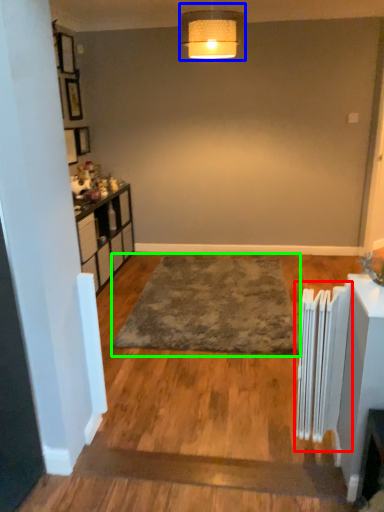
Question: Estimate the real-world distances between objects in this image. Which object is closer to radiator (highlighted by a red box), lamp (highlighted by a blue box) or mat (highlighted by a green box)?

Choices:
 (A) lamp
 (B) mat

Answer: (B)